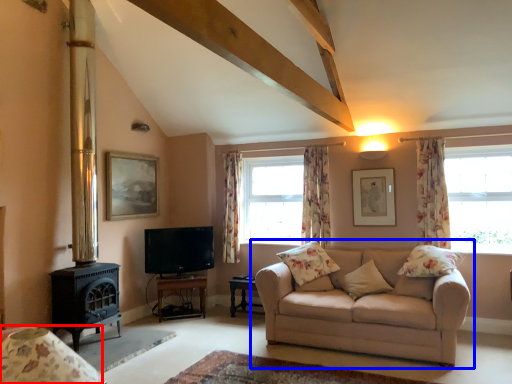
Question: Which of the following is the farthest to the observer, armchair (highlighted by a red box) or studio couch (highlighted by a blue box)?

Choices:
 (A) armchair
 (B) studio couch

Answer: (B)